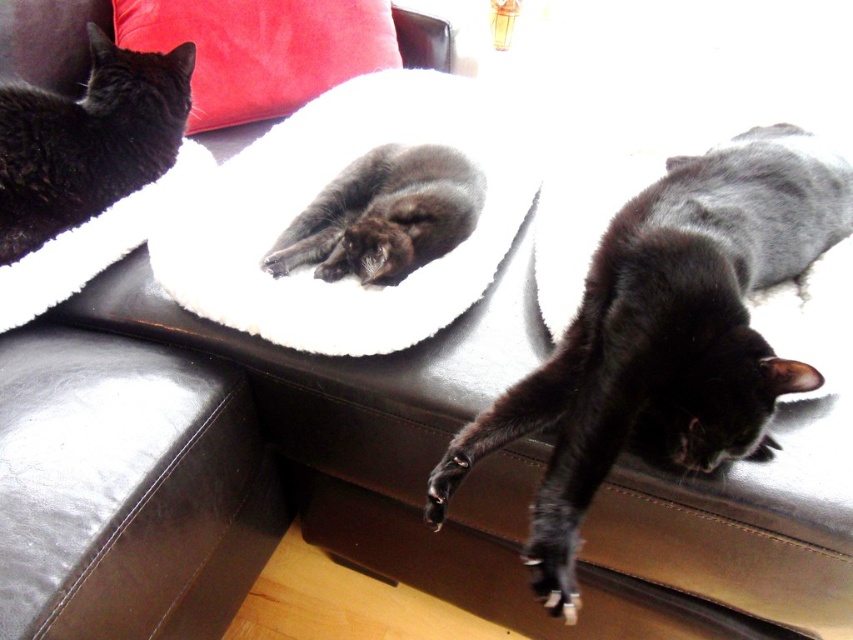
Between black soft fur cat at upper left and velvet red pillow at upper left, which one is positioned higher?

velvet red pillow at upper left

Looking at this image, who is positioned more to the left, black soft fur cat at upper left or velvet red pillow at upper left?

From the viewer's perspective, black soft fur cat at upper left appears more on the left side.

Where is `black soft fur cat at upper left`? The image size is (853, 640). black soft fur cat at upper left is located at coordinates (88, 140).

Locate an element on the screen. Image resolution: width=853 pixels, height=640 pixels. black soft fur cat at upper left is located at coordinates (88, 140).

Which is more to the right, shiny black cat at lower right or soft gray fur cat at center?

Positioned to the right is shiny black cat at lower right.

This screenshot has height=640, width=853. What are the coordinates of `shiny black cat at lower right` in the screenshot? It's located at (666, 337).

Who is positioned more to the right, white fluffy cat bed at center or black soft fur cat at upper left?

white fluffy cat bed at center

What do you see at coordinates (314, 196) in the screenshot?
I see `white fluffy cat bed at center` at bounding box center [314, 196].

The image size is (853, 640). I want to click on white fluffy cat bed at center, so click(x=314, y=196).